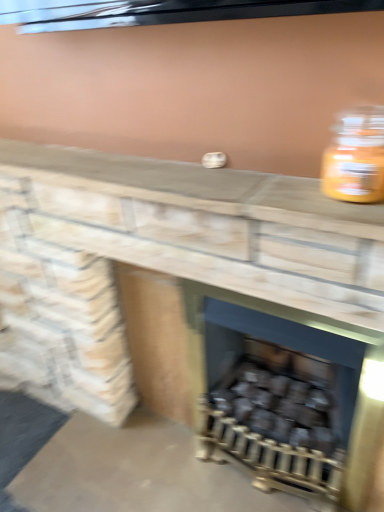
What is the approximate height of black matte wood at center?

black matte wood at center is 11.23 inches tall.

This screenshot has height=512, width=384. What do you see at coordinates (196, 291) in the screenshot?
I see `smooth stone fireplace at center` at bounding box center [196, 291].

Describe the element at coordinates (356, 157) in the screenshot. The width and height of the screenshot is (384, 512). I see `translucent glass jar at upper right` at that location.

The width and height of the screenshot is (384, 512). In order to click on black matte wood at center in this screenshot , I will do pos(279,398).

Which point is more forward, (149, 184) or (151, 181)?

Point (149, 184)

From a real-world perspective, who is located lower, smooth stone counter at center or smooth stone fireplace at center?

From a 3D spatial view, smooth stone fireplace at center is below.

Is smooth stone counter at center taller or shorter than smooth stone fireplace at center?

In the image, smooth stone counter at center appears to be shorter than smooth stone fireplace at center.

Is smooth stone fireplace at center touching translucent glass jar at upper right?

There is a gap between smooth stone fireplace at center and translucent glass jar at upper right.

Looking at this image, in terms of height, does smooth stone fireplace at center look taller or shorter compared to translucent glass jar at upper right?

In the image, smooth stone fireplace at center appears to be taller than translucent glass jar at upper right.

From the image's perspective, which one is positioned higher, smooth stone fireplace at center or translucent glass jar at upper right?

translucent glass jar at upper right appears higher in the image.

Who is shorter, translucent glass jar at upper right or smooth stone fireplace at center?

Standing shorter between the two is translucent glass jar at upper right.

Does point (355, 141) appear closer or farther from the camera than point (19, 337)?

Point (355, 141) is positioned closer to the camera compared to point (19, 337).

You are a GUI agent. You are given a task and a screenshot of the screen. Output one action in this format:
    pyautogui.click(x=<x>, y=<y>)
    Task: Click on the fireplace lying on the left of translucent glass jar at upper right
    
    Given the screenshot: What is the action you would take?
    pyautogui.click(x=196, y=291)

From the image's perspective, between translucent glass jar at upper right and smooth stone fireplace at center, who is located below?

smooth stone fireplace at center, from the image's perspective.

Relative to smooth stone counter at center, is dark gray matte wood burning stove at center in front or behind?

Clearly, dark gray matte wood burning stove at center is behind smooth stone counter at center.

Can you confirm if dark gray matte wood burning stove at center is bigger than smooth stone counter at center?

Yes.

Can you confirm if dark gray matte wood burning stove at center is positioned to the right of smooth stone counter at center?

Indeed, dark gray matte wood burning stove at center is positioned on the right side of smooth stone counter at center.

At what (x,y) coordinates should I click in order to perform the action: click on wood burning stove behind the smooth stone counter at center. Please return your answer as a coordinate pair (x, y). The height and width of the screenshot is (512, 384). Looking at the image, I should click on (259, 311).

Considering the positions of objects black matte wood at center and smooth stone counter at center in the image provided, who is behind, black matte wood at center or smooth stone counter at center?

black matte wood at center is more distant.

Where is `counter top in front of the black matte wood at center`? The height and width of the screenshot is (512, 384). counter top in front of the black matte wood at center is located at coordinates (195, 187).

From the image's perspective, is black matte wood at center located above or below smooth stone counter at center?

black matte wood at center is situated lower than smooth stone counter at center in the image.

Is smooth stone counter at center smaller than black matte wood at center?

Correct, smooth stone counter at center occupies less space than black matte wood at center.

Does smooth stone counter at center contain black matte wood at center?

No, black matte wood at center is not surrounded by smooth stone counter at center.

You are a GUI agent. You are given a task and a screenshot of the screen. Output one action in this format:
    pyautogui.click(x=<x>, y=<y>)
    Task: Click on the burn below the smooth stone counter at center (from a real-world perspective)
    
    Given the screenshot: What is the action you would take?
    pyautogui.click(x=279, y=398)

Is smooth stone counter at center in front of black matte wood at center?

Yes, it is in front of black matte wood at center.

Does dark gray matte wood burning stove at center appear on the left side of translucent glass jar at upper right?

Indeed, dark gray matte wood burning stove at center is positioned on the left side of translucent glass jar at upper right.

Between dark gray matte wood burning stove at center and translucent glass jar at upper right, which one has more height?

dark gray matte wood burning stove at center is taller.

Is dark gray matte wood burning stove at center far from translucent glass jar at upper right?

No, dark gray matte wood burning stove at center is in close proximity to translucent glass jar at upper right.

Can you confirm if dark gray matte wood burning stove at center is smaller than translucent glass jar at upper right?

Incorrect, dark gray matte wood burning stove at center is not smaller in size than translucent glass jar at upper right.

This screenshot has height=512, width=384. I want to click on fireplace in front of the smooth stone counter at center, so click(x=196, y=291).

Find the location of a particular element. Image resolution: width=384 pixels, height=512 pixels. bottle above the smooth stone fireplace at center (from the image's perspective) is located at coordinates (356, 157).

Considering their positions, is dark gray matte wood burning stove at center positioned further to translucent glass jar at upper right than smooth stone counter at center?

Based on the image, dark gray matte wood burning stove at center appears to be further to translucent glass jar at upper right.

When comparing their distances from black matte wood at center, does smooth stone counter at center or translucent glass jar at upper right seem closer?

smooth stone counter at center is positioned closer to the anchor black matte wood at center.

Considering their positions, is translucent glass jar at upper right positioned closer to black matte wood at center than smooth stone fireplace at center?

Based on the image, smooth stone fireplace at center appears to be nearer to black matte wood at center.

From the image, which object appears to be farther from smooth stone counter at center, smooth stone fireplace at center or translucent glass jar at upper right?

smooth stone fireplace at center lies further to smooth stone counter at center than the other object.

When comparing their distances from translucent glass jar at upper right, does black matte wood at center or dark gray matte wood burning stove at center seem further?

black matte wood at center is further to translucent glass jar at upper right.

Estimate the real-world distances between objects in this image. Which object is closer to smooth stone fireplace at center, smooth stone counter at center or dark gray matte wood burning stove at center?

Among the two, dark gray matte wood burning stove at center is located nearer to smooth stone fireplace at center.

Considering their positions, is translucent glass jar at upper right positioned further to dark gray matte wood burning stove at center than black matte wood at center?

translucent glass jar at upper right.

Based on their spatial positions, is translucent glass jar at upper right or black matte wood at center closer to smooth stone fireplace at center?

black matte wood at center lies closer to smooth stone fireplace at center than the other object.

At what (x,y) coordinates should I click in order to perform the action: click on wood burning stove between smooth stone fireplace at center and black matte wood at center from front to back. Please return your answer as a coordinate pair (x, y). The height and width of the screenshot is (512, 384). Looking at the image, I should click on tap(259, 311).

Image resolution: width=384 pixels, height=512 pixels. I want to click on fireplace between translucent glass jar at upper right and black matte wood at center in the vertical direction, so click(196, 291).

The height and width of the screenshot is (512, 384). I want to click on bottle that lies between smooth stone counter at center and dark gray matte wood burning stove at center from top to bottom, so click(356, 157).

Identify the location of wood burning stove between translucent glass jar at upper right and black matte wood at center in the up-down direction. (259, 311).